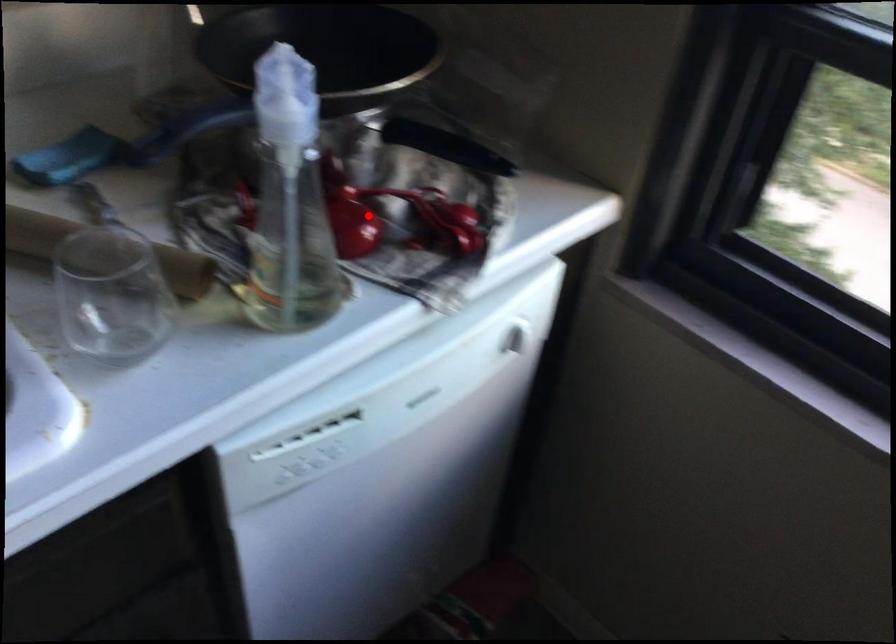
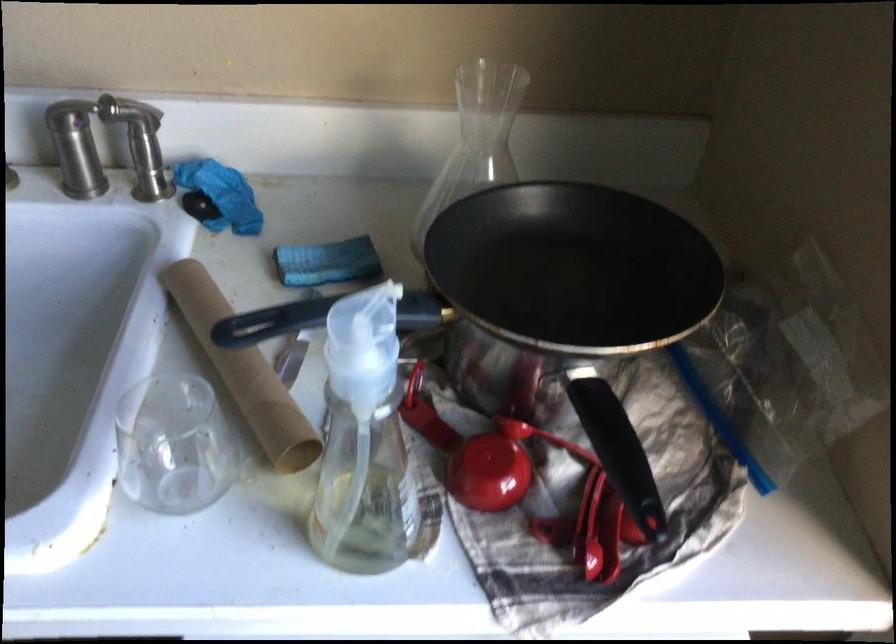
In the second image, find the point that corresponds to the highlighted location in the first image.

(512, 469)